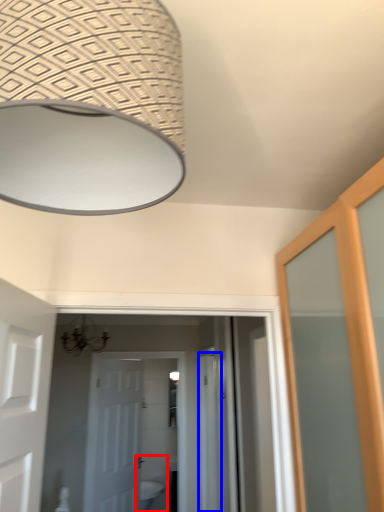
Question: Which object is closer to the camera taking this photo, sink (highlighted by a red box) or screen door (highlighted by a blue box)?

Choices:
 (A) sink
 (B) screen door

Answer: (B)